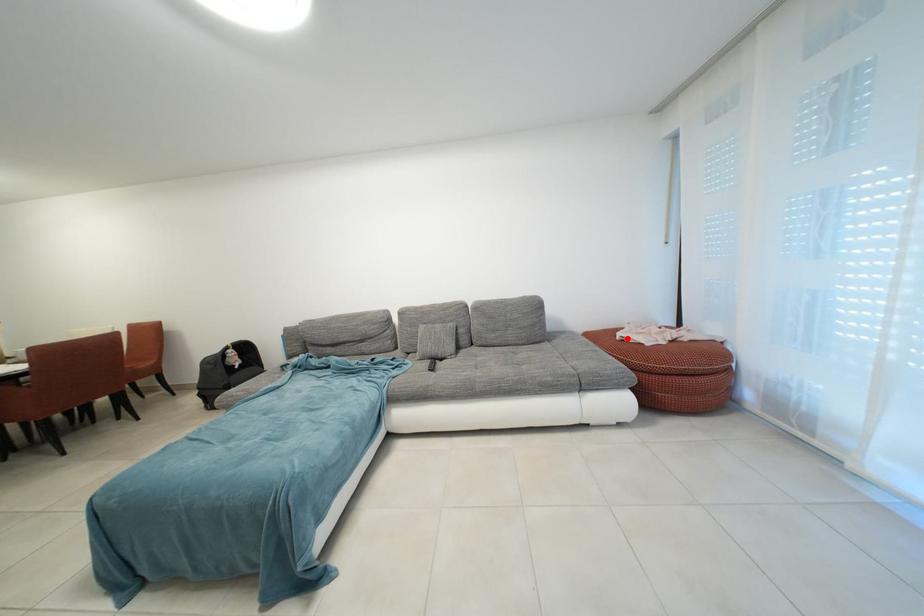
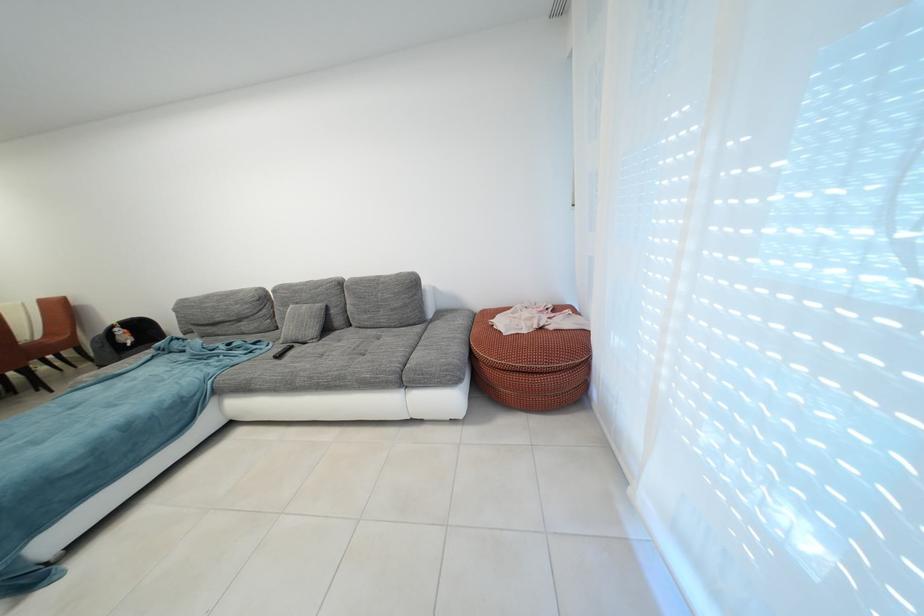
Question: I am providing you with two images of the same scene from different viewpoints. Given a red point in image1, look at the same physical point in image2. Is it:

Choices:
 (A) Closer to the viewpoint
 (B) Farther from the viewpoint

Answer: (B)